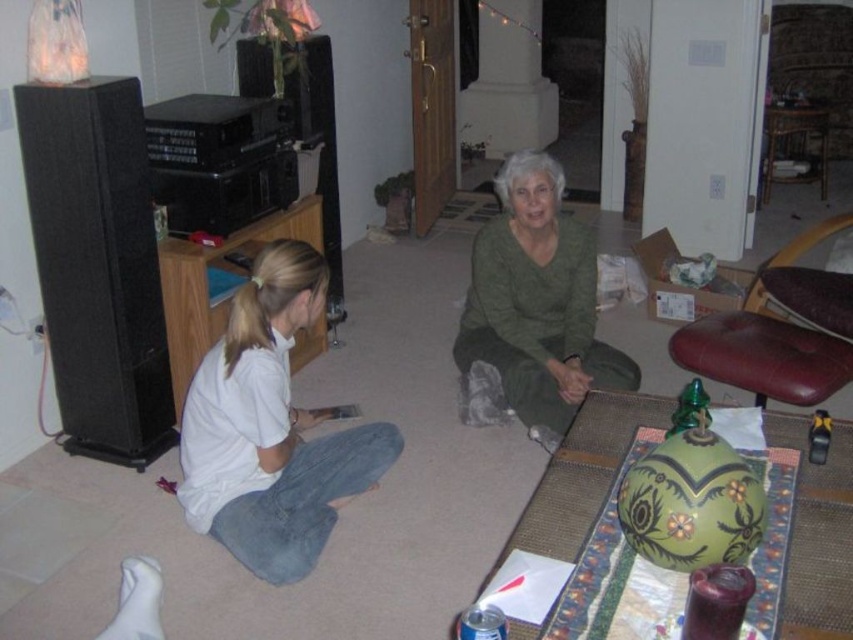
You are a photographer setting up a shoot in this living room. You need to position a light source so that it illuminates both the white cotton shirt at lower left and the green matte sweater at center without casting harsh shadows. Based on their positions, where should you place the light source relative to these two objects?

The white cotton shirt at lower left is below the green matte sweater at center. To evenly illuminate both without harsh shadows, place the light source above and between them, ensuring it covers both areas effectively.